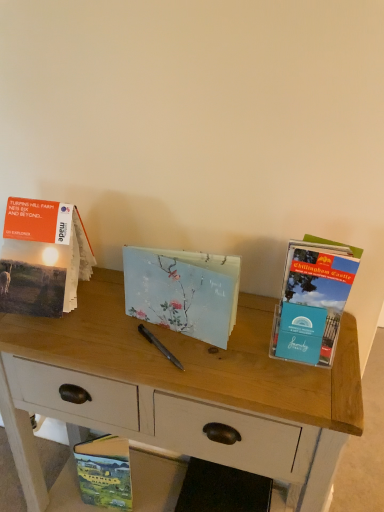
Find the location of `vacant area that is in front of light blue textured notebook at center, which is the 3th book from bottom to top`. vacant area that is in front of light blue textured notebook at center, which is the 3th book from bottom to top is located at coordinates [x=189, y=369].